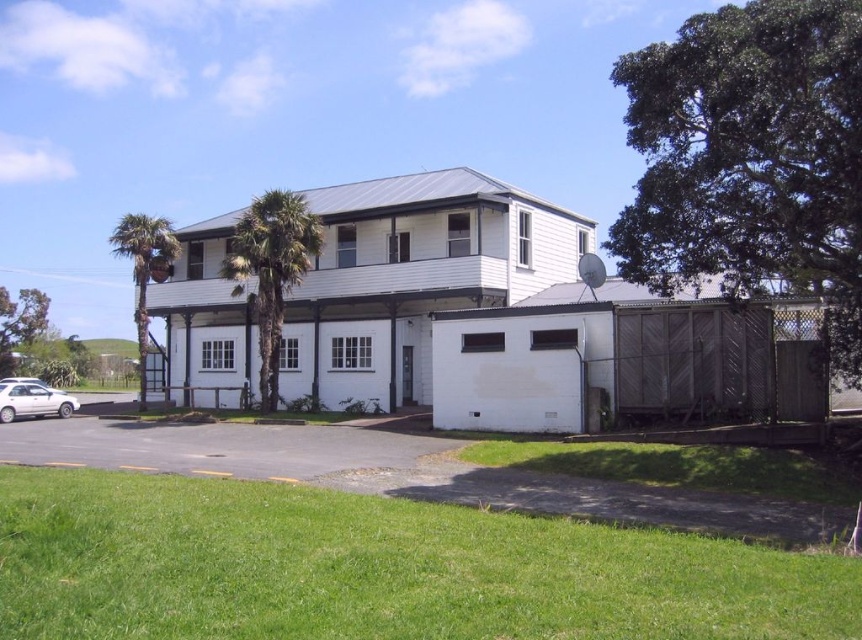
Question: Which object is positioned farthest from the white matte sedan at lower left?

Choices:
 (A) green leafy palm tree at center
 (B) green leafy tree at right
 (C) green leafy tree at lower left
 (D) green leafy palm tree at left

Answer: (C)

Question: Which of these objects is positioned closest to the green leafy palm tree at center?

Choices:
 (A) green leafy palm tree at left
 (B) white matte sedan at lower left
 (C) green leafy tree at lower left
 (D) green leafy tree at right

Answer: (B)

Question: Can you confirm if green leafy palm tree at center is positioned below white matte sedan at lower left?

Choices:
 (A) yes
 (B) no

Answer: (B)

Question: Does green leafy palm tree at left have a lesser width compared to green leafy tree at lower left?

Choices:
 (A) yes
 (B) no

Answer: (B)

Question: Among these objects, which one is farthest from the camera?

Choices:
 (A) green leafy tree at lower left
 (B) green leafy tree at right

Answer: (A)

Question: Is green leafy tree at right wider than white matte sedan at lower left?

Choices:
 (A) yes
 (B) no

Answer: (A)